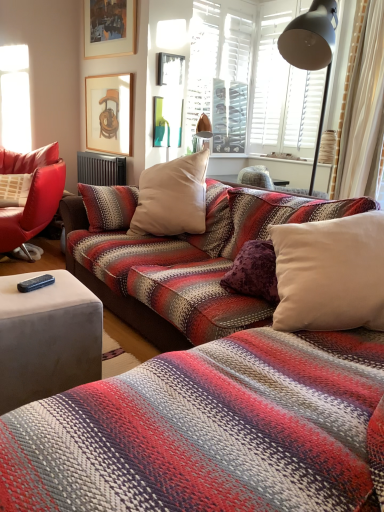
Locate an element on the screen. free space to the left of black rubber remote control at lower left is located at coordinates (14, 284).